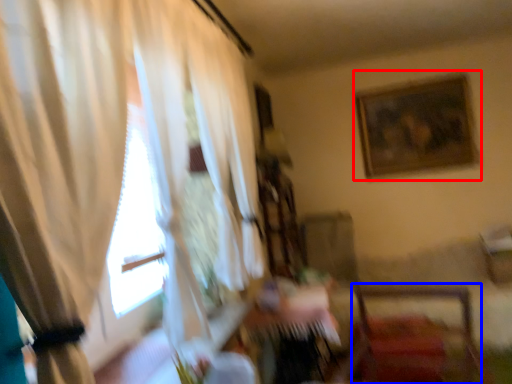
Question: Among these objects, which one is nearest to the camera, picture frame (highlighted by a red box) or chair (highlighted by a blue box)?

Choices:
 (A) picture frame
 (B) chair

Answer: (B)